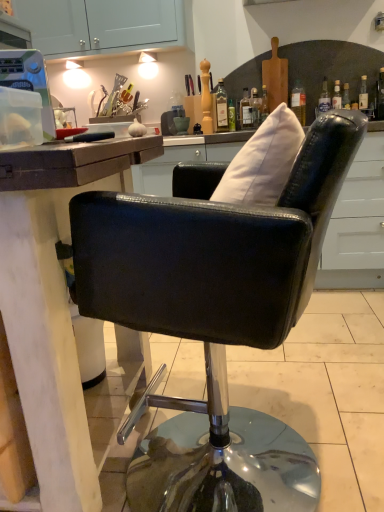
Question: Is green glass bottle at upper center, the second bottle when ordered from right to left, wider than white fabric pillow at upper center?

Choices:
 (A) yes
 (B) no

Answer: (B)

Question: From the image's perspective, does green glass bottle at upper center, the second bottle when ordered from right to left, appear higher than white fabric pillow at upper center?

Choices:
 (A) no
 (B) yes

Answer: (B)

Question: Is green glass bottle at upper center, the second bottle when ordered from right to left, to the left of white fabric pillow at upper center from the viewer's perspective?

Choices:
 (A) no
 (B) yes

Answer: (A)

Question: From a real-world perspective, is green glass bottle at upper center, which ranks as the second bottle in left-to-right order, located beneath white fabric pillow at upper center?

Choices:
 (A) no
 (B) yes

Answer: (A)

Question: Is green glass bottle at upper center, the second bottle when ordered from right to left, oriented towards white fabric pillow at upper center?

Choices:
 (A) no
 (B) yes

Answer: (B)

Question: Relative to transparent plastic container at upper left, is black leather chair at center in front or behind?

Choices:
 (A) behind
 (B) front

Answer: (B)

Question: Do you think black leather chair at center is within transparent plastic container at upper left, or outside of it?

Choices:
 (A) outside
 (B) inside

Answer: (A)

Question: Is black leather chair at center wider or thinner than transparent plastic container at upper left?

Choices:
 (A) wide
 (B) thin

Answer: (A)

Question: Is point (238, 425) closer or farther from the camera than point (9, 78)?

Choices:
 (A) closer
 (B) farther

Answer: (B)

Question: In terms of height, does transparent glass bottle at upper right, which is the 3th bottle in left-to-right order, look taller or shorter compared to white fabric pillow at upper center?

Choices:
 (A) short
 (B) tall

Answer: (B)

Question: Looking at the image, does transparent glass bottle at upper right, arranged as the 1th bottle when viewed from the right, seem bigger or smaller compared to white fabric pillow at upper center?

Choices:
 (A) big
 (B) small

Answer: (B)

Question: Visually, is transparent glass bottle at upper right, arranged as the 1th bottle when viewed from the right, positioned to the left or to the right of white fabric pillow at upper center?

Choices:
 (A) right
 (B) left

Answer: (A)

Question: Is transparent glass bottle at upper right, arranged as the 1th bottle when viewed from the right, spatially inside white fabric pillow at upper center, or outside of it?

Choices:
 (A) inside
 (B) outside

Answer: (B)

Question: Is white fabric pillow at upper center bigger or smaller than transparent plastic container at upper left?

Choices:
 (A) small
 (B) big

Answer: (B)

Question: Considering the positions of white fabric pillow at upper center and transparent plastic container at upper left in the image, is white fabric pillow at upper center wider or thinner than transparent plastic container at upper left?

Choices:
 (A) wide
 (B) thin

Answer: (B)